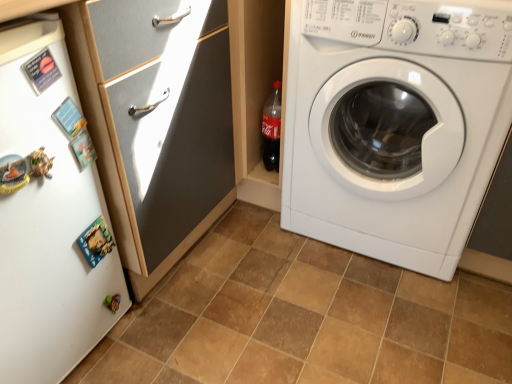
Image resolution: width=512 pixels, height=384 pixels. What do you see at coordinates (303, 318) in the screenshot?
I see `brown matte tile at center` at bounding box center [303, 318].

Measure the distance between brown matte tile at center and camera.

The distance of brown matte tile at center from camera is 3.56 feet.

The height and width of the screenshot is (384, 512). What do you see at coordinates (416, 137) in the screenshot? I see `white glossy washing machine at right` at bounding box center [416, 137].

Find the location of a particular element. white glossy cabinet at upper left is located at coordinates (166, 119).

Between white glossy washing machine at right and white matte refrigerator at left, which one has smaller size?

With smaller size is white matte refrigerator at left.

Is white glossy washing machine at right looking in the opposite direction of white matte refrigerator at left?

No, white matte refrigerator at left is not at the back of white glossy washing machine at right.

From a real-world perspective, is white glossy washing machine at right located higher than white matte refrigerator at left?

No.

From the image's perspective, between white glossy cabinet at upper left and white glossy washing machine at right, which one is located above?

white glossy washing machine at right appears higher in the image.

Does white glossy cabinet at upper left have a greater height compared to white glossy washing machine at right?

Correct, white glossy cabinet at upper left is much taller as white glossy washing machine at right.

How many degrees apart are the facing directions of white glossy cabinet at upper left and white glossy washing machine at right?

They differ by 89 degrees in their facing directions.

Choose the correct answer: Is white glossy cabinet at upper left inside white glossy washing machine at right or outside it?

white glossy cabinet at upper left is located beyond the bounds of white glossy washing machine at right.

From the image's perspective, is white matte refrigerator at left positioned above or below white glossy washing machine at right?

From the image's perspective, white matte refrigerator at left appears below white glossy washing machine at right.

Considering the sizes of objects white matte refrigerator at left and white glossy washing machine at right in the image provided, who is thinner, white matte refrigerator at left or white glossy washing machine at right?

white matte refrigerator at left is thinner.

Which of these two, white matte refrigerator at left or white glossy washing machine at right, stands shorter?

white matte refrigerator at left.

From a real-world perspective, which is physically below, white matte refrigerator at left or white glossy washing machine at right?

white glossy washing machine at right.

Considering the relative sizes of brown matte tile at center and white matte refrigerator at left in the image provided, is brown matte tile at center taller than white matte refrigerator at left?

No.

Does brown matte tile at center appear on the left side of white matte refrigerator at left?

Incorrect, brown matte tile at center is not on the left side of white matte refrigerator at left.

Is brown matte tile at center looking in the opposite direction of white matte refrigerator at left?

That's not correct — brown matte tile at center is not looking away from white matte refrigerator at left.

Consider the image. Does brown matte tile at center come behind white matte refrigerator at left?

Yes, the depth of brown matte tile at center is greater than that of white matte refrigerator at left.

From the image's perspective, is white glossy cabinet at upper left located beneath brown matte tile at center?

No.

Find the location of a particular element. screen door behind the brown matte tile at center is located at coordinates (166, 119).

Are white glossy cabinet at upper left and brown matte tile at center making contact?

white glossy cabinet at upper left and brown matte tile at center are not in contact.

From a real-world perspective, which object stands above the other?

white glossy cabinet at upper left is physically above.

Is brown matte tile at center at the back of white glossy washing machine at right?

That's not correct — white glossy washing machine at right is not looking away from brown matte tile at center.

Considering the relative sizes of white glossy washing machine at right and brown matte tile at center in the image provided, is white glossy washing machine at right thinner than brown matte tile at center?

Yes, white glossy washing machine at right is thinner than brown matte tile at center.

Is white glossy washing machine at right not inside brown matte tile at center?

Indeed, white glossy washing machine at right is completely outside brown matte tile at center.

Does point (40, 234) come farther from viewer compared to point (205, 124)?

No, it is not.

Is white glossy cabinet at upper left at the back of white matte refrigerator at left?

No, white matte refrigerator at left is not facing the opposite direction of white glossy cabinet at upper left.

Where is `fridge above the white glossy washing machine at right (from a real-world perspective)`? The image size is (512, 384). fridge above the white glossy washing machine at right (from a real-world perspective) is located at coordinates (48, 220).

I want to click on washing machine directly beneath the white glossy cabinet at upper left (from a real-world perspective), so click(x=416, y=137).

Based on the photo, from the image, which object appears to be farther from white glossy cabinet at upper left, brown matte tile at center or white glossy washing machine at right?

Among the two, brown matte tile at center is located further to white glossy cabinet at upper left.

Considering their positions, is white glossy cabinet at upper left positioned further to brown matte tile at center than white matte refrigerator at left?

white matte refrigerator at left is further to brown matte tile at center.

Considering their positions, is white glossy washing machine at right positioned further to white matte refrigerator at left than brown matte tile at center?

Based on the image, white glossy washing machine at right appears to be further to white matte refrigerator at left.

Estimate the real-world distances between objects in this image. Which object is closer to brown matte tile at center, white glossy washing machine at right or white matte refrigerator at left?

white glossy washing machine at right is positioned closer to the anchor brown matte tile at center.

Which object lies nearer to the anchor point white glossy washing machine at right, white matte refrigerator at left or brown matte tile at center?

The object closer to white glossy washing machine at right is brown matte tile at center.

When comparing their distances from white glossy cabinet at upper left, does white matte refrigerator at left or brown matte tile at center seem further?

brown matte tile at center is positioned further to the anchor white glossy cabinet at upper left.

Which object lies nearer to the anchor point white matte refrigerator at left, brown matte tile at center or white glossy washing machine at right?

Based on the image, brown matte tile at center appears to be nearer to white matte refrigerator at left.

Looking at the image, which one is located further to white matte refrigerator at left, brown matte tile at center or white glossy cabinet at upper left?

The object further to white matte refrigerator at left is brown matte tile at center.

The width and height of the screenshot is (512, 384). Identify the location of ceramic tile between white matte refrigerator at left and white glossy washing machine at right in the horizontal direction. (303, 318).

Identify the location of ceramic tile between white glossy cabinet at upper left and white glossy washing machine at right in the horizontal direction. The height and width of the screenshot is (384, 512). (303, 318).

Find the location of a particular element. screen door between white matte refrigerator at left and brown matte tile at center in the horizontal direction is located at coordinates (166, 119).

This screenshot has height=384, width=512. Identify the location of screen door between white matte refrigerator at left and white glossy washing machine at right in the horizontal direction. (166, 119).